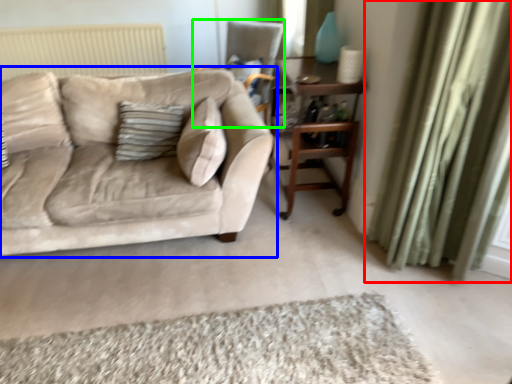
Question: Based on their relative distances, which object is nearer to curtain (highlighted by a red box)? Choose from studio couch (highlighted by a blue box) and chair (highlighted by a green box).

Choices:
 (A) studio couch
 (B) chair

Answer: (A)